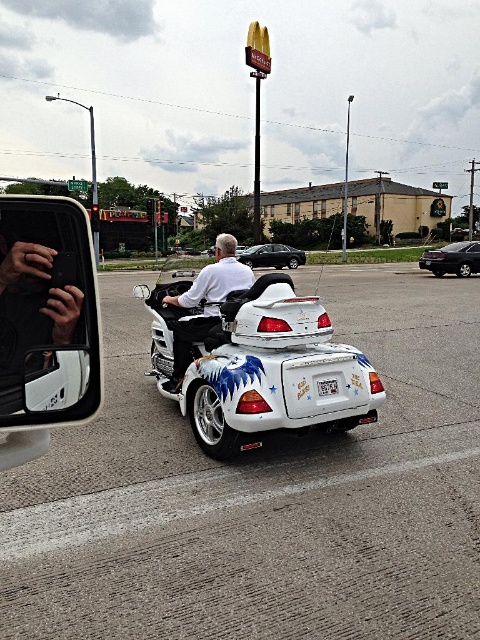
Question: Does shiny black sedan at right appear on the left side of white glossy license plate at rear?

Choices:
 (A) yes
 (B) no

Answer: (B)

Question: Can you confirm if white glossy trike at center is positioned below white glossy motorcycle at center?

Choices:
 (A) yes
 (B) no

Answer: (A)

Question: Which object is farther from the camera taking this photo?

Choices:
 (A) black glossy side mirror at left
 (B) shiny black sedan at center
 (C) white glossy motorcycle at center

Answer: (B)

Question: Which point is closer to the camera taking this photo?

Choices:
 (A) (320, 388)
 (B) (171, 372)

Answer: (A)

Question: Can you confirm if shiny black sedan at right is wider than white glossy license plate at rear?

Choices:
 (A) yes
 (B) no

Answer: (A)

Question: Which object is farther from the camera taking this photo?

Choices:
 (A) white glossy motorcycle at center
 (B) shiny black sedan at right
 (C) black glossy side mirror at left

Answer: (B)